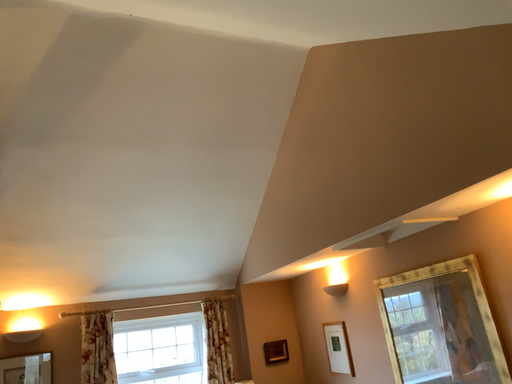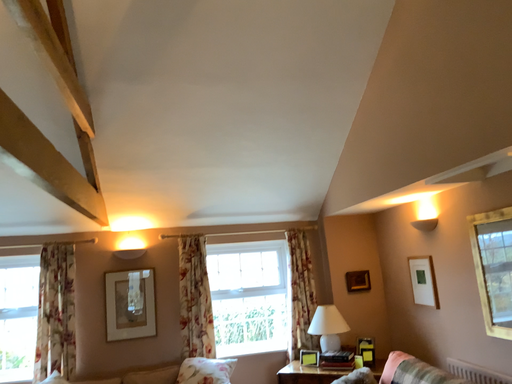
Question: Which way did the camera rotate in the video?

Choices:
 (A) rotated left
 (B) rotated right

Answer: (A)